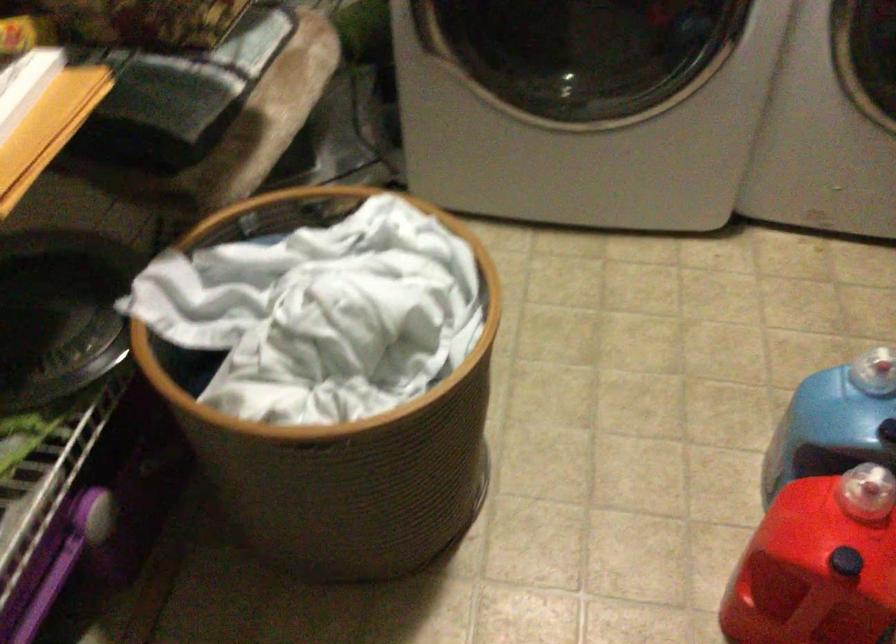
At what (x,y) coordinates should I click in order to perform the action: click on blue container cap. Please return your answer as a coordinate pair (x, y). The width and height of the screenshot is (896, 644). Looking at the image, I should click on [872, 373].